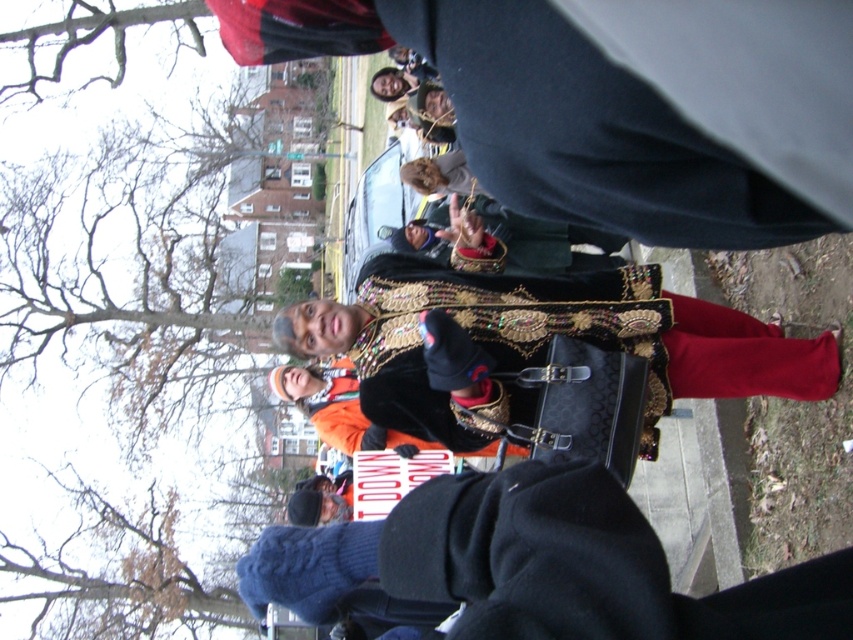
Question: Which of the following is the farthest from the observer?

Choices:
 (A) (341, 582)
 (B) (608, 305)

Answer: (B)

Question: Is knitted wool sweater at lower center bigger than velvet black cape at center?

Choices:
 (A) yes
 (B) no

Answer: (B)

Question: Does knitted wool sweater at lower center have a lesser width compared to velvet black cape at center?

Choices:
 (A) yes
 (B) no

Answer: (A)

Question: Is knitted wool sweater at lower center below velvet black cape at center?

Choices:
 (A) no
 (B) yes

Answer: (B)